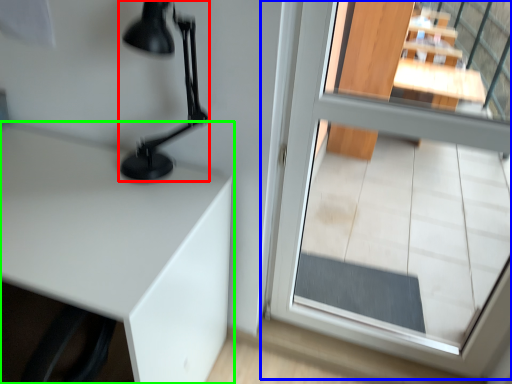
Question: Which is farther away from table lamp (highlighted by a red box)? glass door (highlighted by a blue box) or table (highlighted by a green box)?

Choices:
 (A) glass door
 (B) table

Answer: (A)